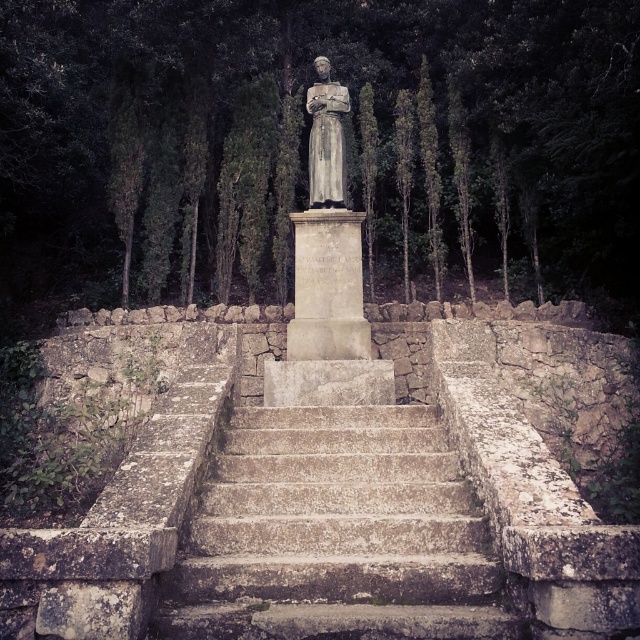
What do you see at coordinates (336, 534) in the screenshot?
I see `rusty stone stairs at center` at bounding box center [336, 534].

Can you confirm if rusty stone stairs at center is positioned to the left of gray stone statue at center?

No, rusty stone stairs at center is not to the left of gray stone statue at center.

The width and height of the screenshot is (640, 640). What do you see at coordinates (336, 534) in the screenshot?
I see `rusty stone stairs at center` at bounding box center [336, 534].

Locate an element on the screen. rusty stone stairs at center is located at coordinates (336, 534).

Is point (403, 288) farther from viewer compared to point (452, 531)?

Yes, it is.

Which is more to the left, green leafy trees at center or rusty stone stairs at center?

From the viewer's perspective, green leafy trees at center appears more on the left side.

Is point (225, 56) positioned before point (240, 600)?

No, it is behind (240, 600).

Find the location of a particular element. green leafy trees at center is located at coordinates [x=307, y=145].

Can you confirm if green leafy trees at center is thinner than gray stone statue at center?

No, green leafy trees at center is not thinner than gray stone statue at center.

Is green leafy trees at center shorter than gray stone statue at center?

No, green leafy trees at center is not shorter than gray stone statue at center.

The image size is (640, 640). Describe the element at coordinates (307, 145) in the screenshot. I see `green leafy trees at center` at that location.

I want to click on green leafy trees at center, so click(x=307, y=145).